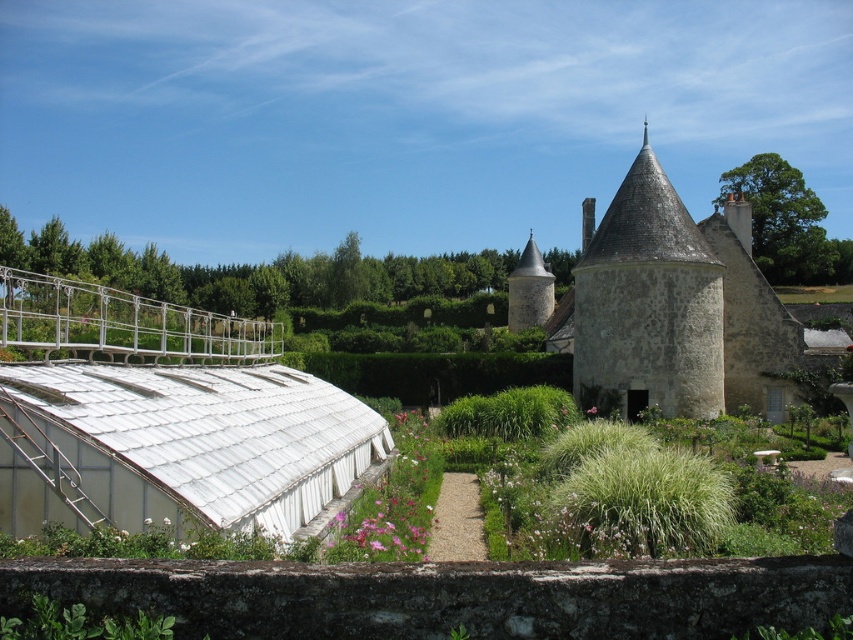
Question: Which object is positioned farthest from the stone textured tower at upper right?

Choices:
 (A) stone tower at center
 (B) green leafy plant at lower left

Answer: (B)

Question: Among these points, which one is farthest from the camera?

Choices:
 (A) (166, 620)
 (B) (634, 392)
 (C) (685, 364)

Answer: (B)

Question: Which object appears closest to the camera in this image?

Choices:
 (A) stone textured tower at upper right
 (B) green leafy plant at lower left

Answer: (B)

Question: Does stone tower at center have a smaller size compared to stone textured tower at upper right?

Choices:
 (A) yes
 (B) no

Answer: (B)

Question: Is the position of stone tower at center less distant than that of stone textured tower at upper right?

Choices:
 (A) yes
 (B) no

Answer: (B)

Question: Can you confirm if stone textured tower at upper right is positioned below green leafy plant at lower left?

Choices:
 (A) yes
 (B) no

Answer: (B)